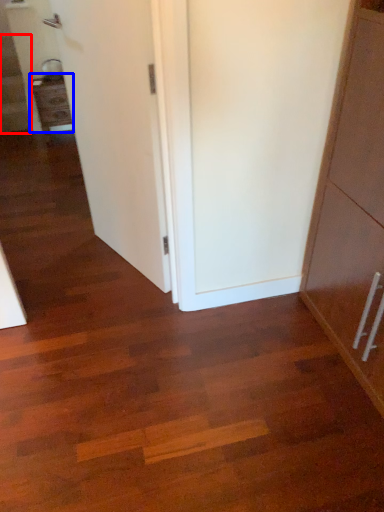
Question: Among these objects, which one is nearest to the camera, stairwell (highlighted by a red box) or cabinetry (highlighted by a blue box)?

Choices:
 (A) stairwell
 (B) cabinetry

Answer: (B)